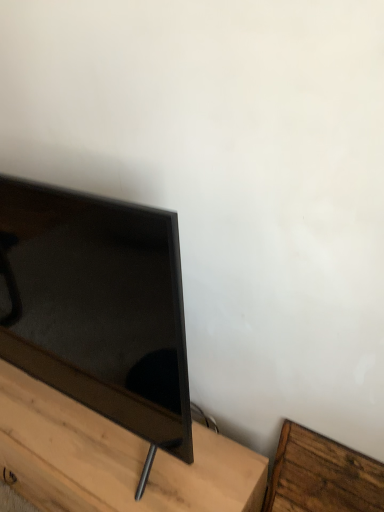
Question: Considering the relative positions of matte black tv stand at lower left, acting as the first furniture starting from the left, and wooden bed frame at lower right, which is the 1th furniture from right to left, in the image provided, is matte black tv stand at lower left, acting as the first furniture starting from the left, to the left or to the right of wooden bed frame at lower right, which is the 1th furniture from right to left,?

Choices:
 (A) left
 (B) right

Answer: (A)

Question: Considering the positions of matte black tv stand at lower left, the 2th furniture in the right-to-left sequence, and wooden bed frame at lower right, which is the 1th furniture from right to left, in the image, is matte black tv stand at lower left, the 2th furniture in the right-to-left sequence, bigger or smaller than wooden bed frame at lower right, which is the 1th furniture from right to left,?

Choices:
 (A) small
 (B) big

Answer: (B)

Question: Which object is the closest to the matte black tv stand at lower left, acting as the first furniture starting from the left?

Choices:
 (A) matte black tv at left
 (B) wooden bed frame at lower right, which is the 1th furniture from right to left

Answer: (A)

Question: Which object is the closest to the wooden bed frame at lower right, arranged as the second furniture when viewed from the left?

Choices:
 (A) matte black tv at left
 (B) matte black tv stand at lower left, the 2th furniture in the right-to-left sequence

Answer: (B)